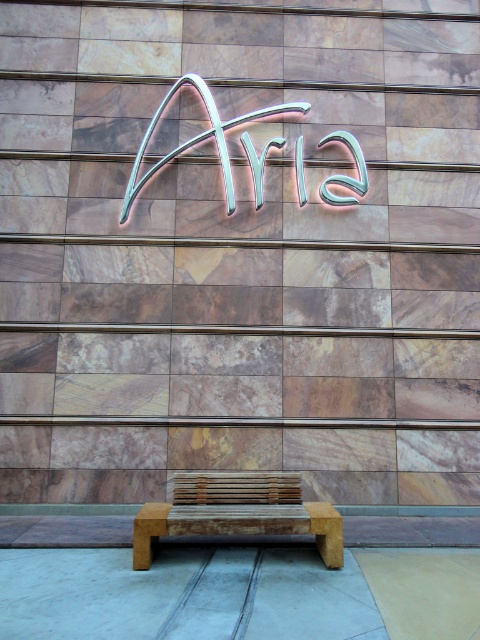
Question: Which object is closer to the camera taking this photo?

Choices:
 (A) metallic neon sign at center
 (B) rustic wood bench at center

Answer: (B)

Question: Is rustic wood bench at center to the left of metallic neon sign at center from the viewer's perspective?

Choices:
 (A) yes
 (B) no

Answer: (A)

Question: Is the position of rustic wood bench at center more distant than that of metallic neon sign at center?

Choices:
 (A) yes
 (B) no

Answer: (B)

Question: Which point is farther to the camera?

Choices:
 (A) (183, 508)
 (B) (233, 124)

Answer: (B)

Question: Is rustic wood bench at center wider than metallic neon sign at center?

Choices:
 (A) yes
 (B) no

Answer: (B)